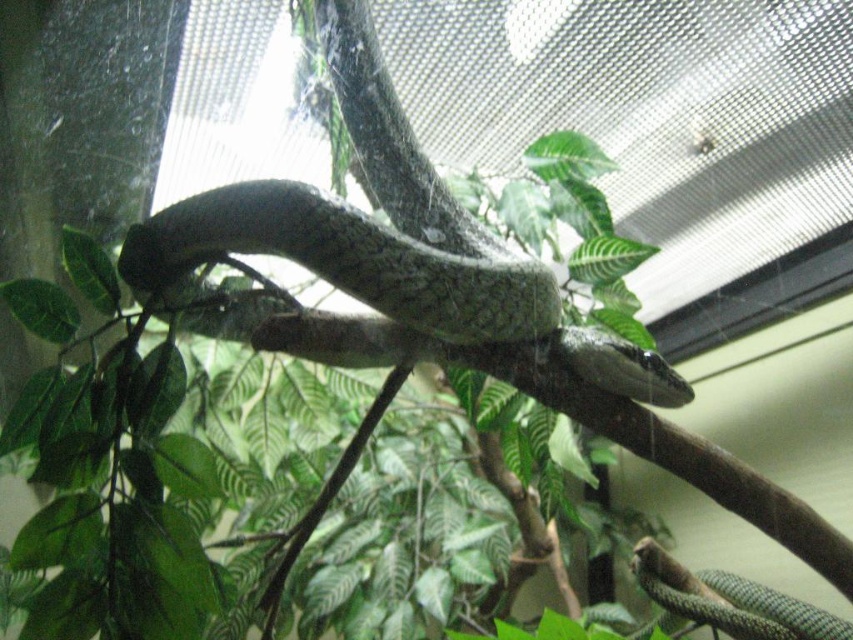
Can you confirm if green scaly snake at center is shorter than green glossy snake at lower right?

Incorrect, green scaly snake at center's height does not fall short of green glossy snake at lower right's.

Identify the location of green scaly snake at center. (389, 237).

Is point (386, 232) closer to camera compared to point (746, 632)?

Yes, it is in front of point (746, 632).

The image size is (853, 640). I want to click on green scaly snake at center, so click(x=389, y=237).